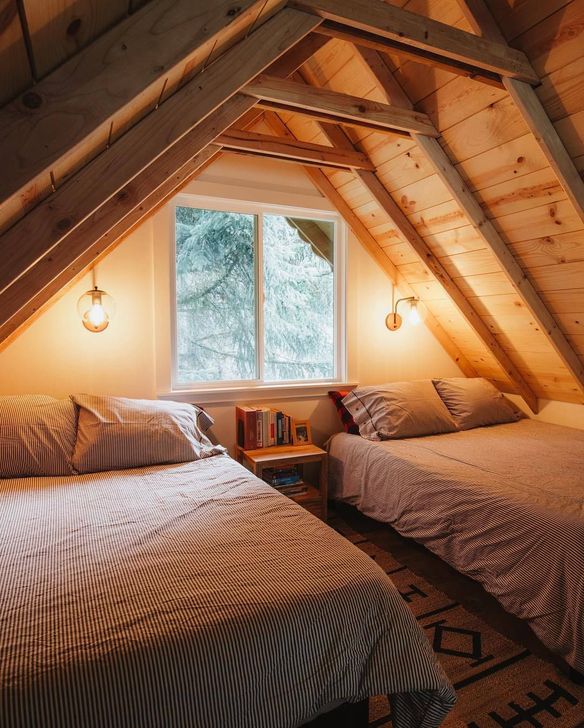
This screenshot has width=584, height=728. Find the location of `photo frame`. photo frame is located at coordinates (295, 438).